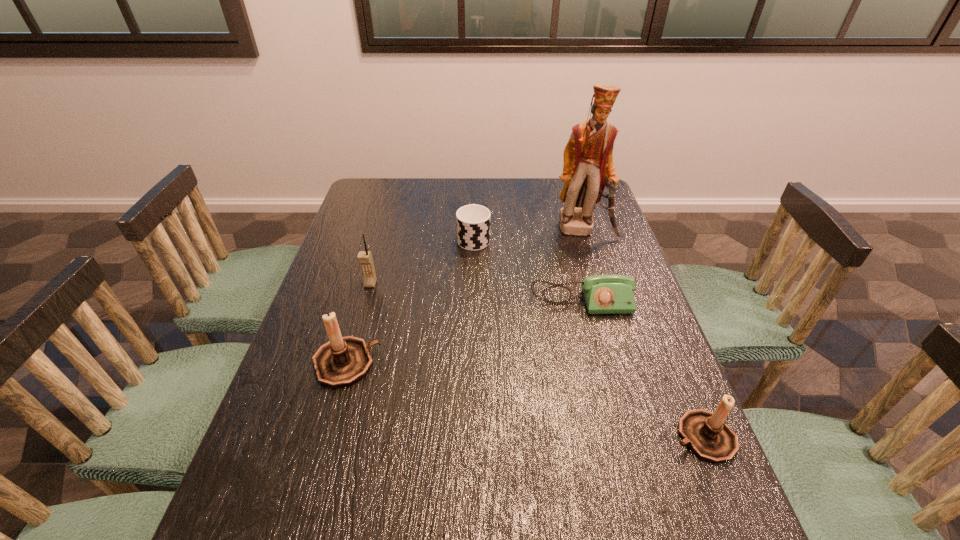
The height and width of the screenshot is (540, 960). Identify the location of vacant space that satisfies the following two spatial constraints: 1. on the front of the cellular telephone, where the keypad is located; 2. on the right side of the fourth tallest object. (327, 437).

You are a GUI agent. You are given a task and a screenshot of the screen. Output one action in this format:
    pyautogui.click(x=<x>, y=<y>)
    Task: Click on the blank area in the image that satisfies the following two spatial constraints: 1. on the front-facing side of the nearer candle holder; 2. on the right side of the tallest object
    
    Given the screenshot: What is the action you would take?
    pyautogui.click(x=648, y=437)